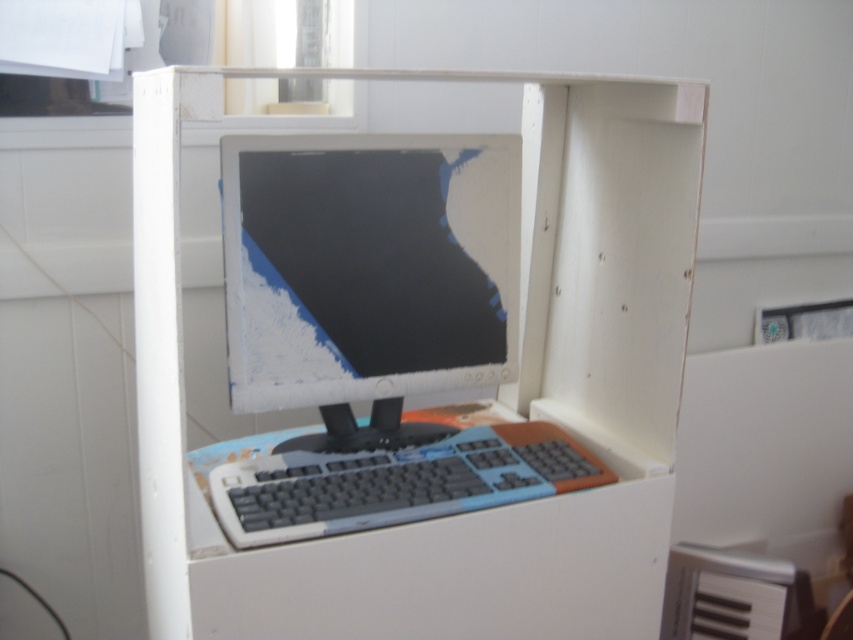
Does matte plastic monitor at center appear under gray plastic keyboard at center?

Incorrect, matte plastic monitor at center is not positioned below gray plastic keyboard at center.

Is matte plastic monitor at center to the left of gray plastic keyboard at center from the viewer's perspective?

Indeed, matte plastic monitor at center is positioned on the left side of gray plastic keyboard at center.

Does point (408, 216) come in front of point (334, 484)?

No, it is not.

Image resolution: width=853 pixels, height=640 pixels. I want to click on matte plastic monitor at center, so click(367, 275).

Is white plastic computer desk at center above gray plastic keyboard at center?

Yes.

Is white plastic computer desk at center wider than gray plastic keyboard at center?

Yes.

Between point (195, 634) and point (306, 436), which one is positioned behind?

The point (306, 436) is behind.

Find the location of a particular element. white plastic computer desk at center is located at coordinates (498, 390).

Is white plastic computer desk at center to the left of matte plastic monitor at center from the viewer's perspective?

No, white plastic computer desk at center is not to the left of matte plastic monitor at center.

Does white plastic computer desk at center have a lesser height compared to matte plastic monitor at center?

In fact, white plastic computer desk at center may be taller than matte plastic monitor at center.

Is point (364, 548) positioned behind point (231, 170)?

No.

Find the location of `white plastic computer desk at center`. white plastic computer desk at center is located at coordinates (498, 390).